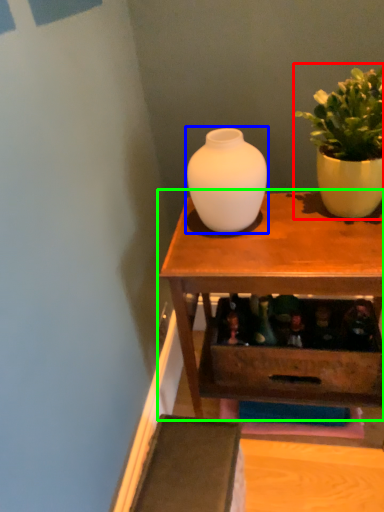
Question: Which object is the closest to the houseplant (highlighted by a red box)? Choose among these: vase (highlighted by a blue box) or table (highlighted by a green box).

Choices:
 (A) vase
 (B) table

Answer: (A)